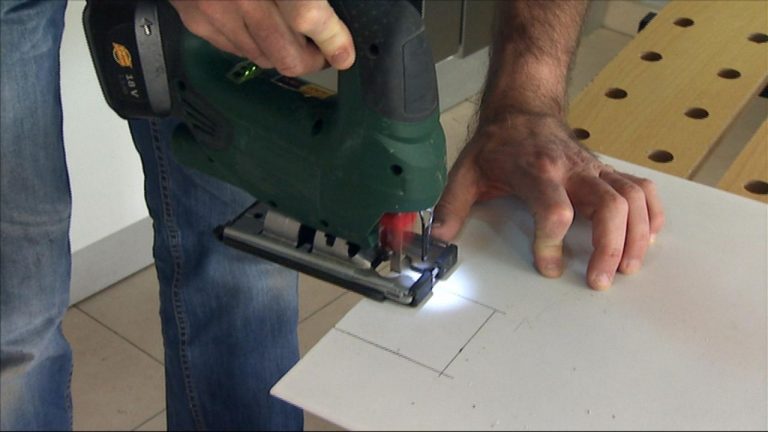
You are a GUI agent. You are given a task and a screenshot of the screen. Output one action in this format:
    pyautogui.click(x=<x>, y=<y>)
    Task: Click on the tile floor
    Image resolution: width=768 pixels, height=432 pixels.
    Given the screenshot: What is the action you would take?
    coord(121,360)